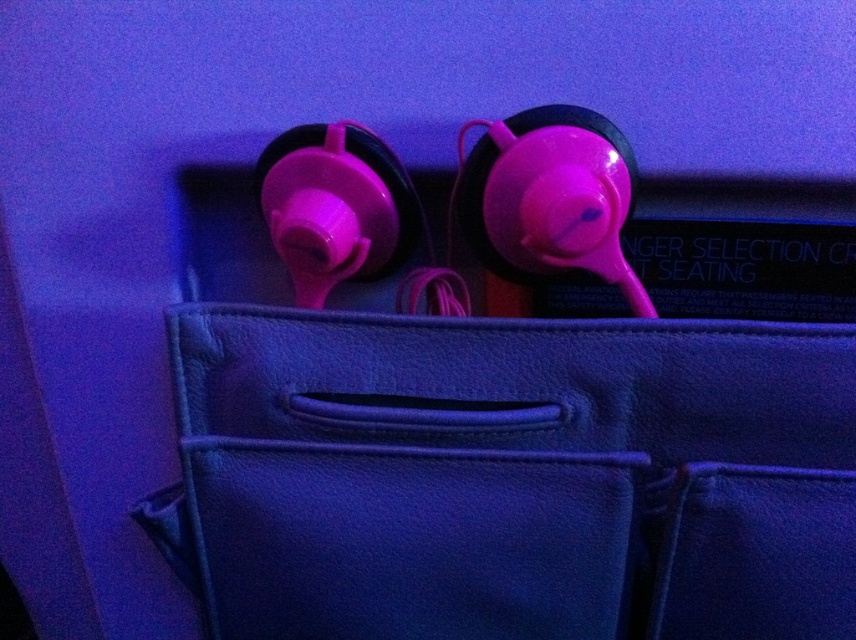
You are an airport security agent inspecting a bag. You notice two points marked on the bag at coordinates point (525, 376) and point (366, 200). According to the security guidelines, items behind the midpoint between these two points must be checked. Where is the midpoint located in relation to the two points?

The midpoint between point (525, 376) and point (366, 200) is at coordinates point 0.451, 0.521. Since point (525, 376) is behind point (366, 200), items behind the midpoint would be closer to point (525, 376).

You are packing for a trip and need to know if the matte pink earphone at upper center can fit inside the leather bag at center. Based on the scene description, can it fit?

The leather bag at center is wider than the matte pink earphone at upper center, so it can fit inside.

Looking at this image, you are packing a small pouch that can only fit items up to 10 cm in width. You have two earphones in your bag, the pink matte earphone at center and the matte pink earphone at upper center. Which one can you safely place in the pouch without exceeding the width limit?

The matte pink earphone at upper center can be safely placed in the pouch since it is narrower than the pink matte earphone at center, which might exceed the 10 cm width limit.